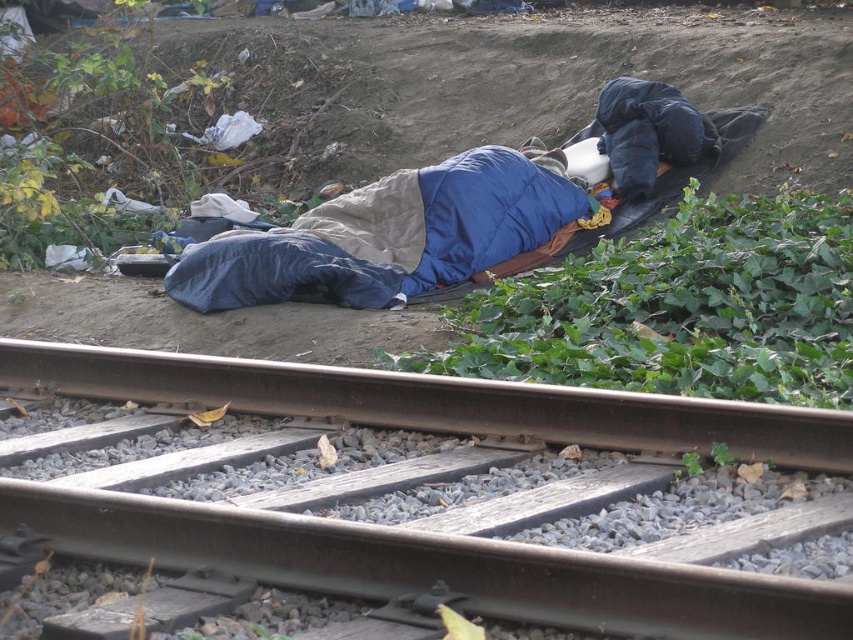
Is brown metal track at center above green leafy vegetation at lower right?

Incorrect, brown metal track at center is not positioned above green leafy vegetation at lower right.

Is point (199, 525) more distant than point (759, 396)?

No.

Where is `brown metal track at center`? This screenshot has height=640, width=853. brown metal track at center is located at coordinates (432, 564).

Which is in front, point (605, 355) or point (618, 106)?

Point (605, 355) is in front.

Looking at this image, who is more forward, (517, 310) or (512, 250)?

Point (517, 310) is more forward.

Locate an element on the screen. Image resolution: width=853 pixels, height=640 pixels. green leafy vegetation at lower right is located at coordinates (677, 308).

Based on the photo, is green leafy vegetation at lower right smaller than brushed metal railway line at center?

Incorrect, green leafy vegetation at lower right is not smaller in size than brushed metal railway line at center.

Find the location of a particular element. green leafy vegetation at lower right is located at coordinates (677, 308).